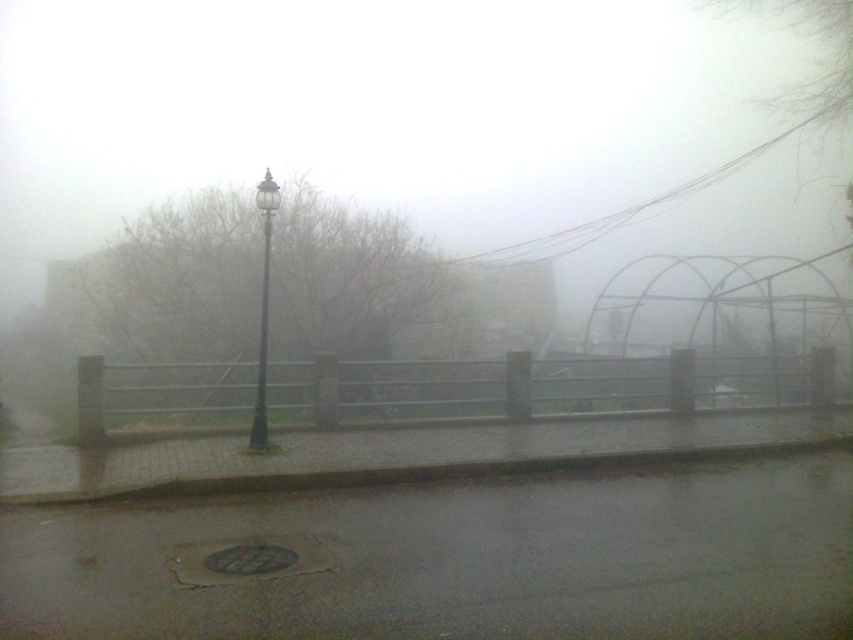
Which is behind, point (341, 524) or point (271, 188)?

Point (271, 188)

Is wet asphalt at lower center positioned before black polished street light at center?

Yes, it is in front of black polished street light at center.

Which is behind, point (419, 616) or point (265, 296)?

Positioned behind is point (265, 296).

Image resolution: width=853 pixels, height=640 pixels. I want to click on wet asphalt at lower center, so click(x=450, y=557).

Can you confirm if black polished street light at center is positioned to the left of black polished pole at center?

Correct, you'll find black polished street light at center to the left of black polished pole at center.

Is black polished street light at center smaller than black polished pole at center?

Incorrect, black polished street light at center is not smaller in size than black polished pole at center.

Who is more forward, (260, 320) or (260, 429)?

Positioned in front is point (260, 429).

This screenshot has height=640, width=853. Find the location of `black polished street light at center`. black polished street light at center is located at coordinates tap(263, 310).

Measure the distance from wet asphalt at lower center to black polished pole at center.

5.03 meters

Does wet asphalt at lower center lie in front of black polished pole at center?

Yes.

Which is behind, point (20, 625) or point (265, 433)?

Point (265, 433)

This screenshot has width=853, height=640. I want to click on wet asphalt at lower center, so click(x=450, y=557).